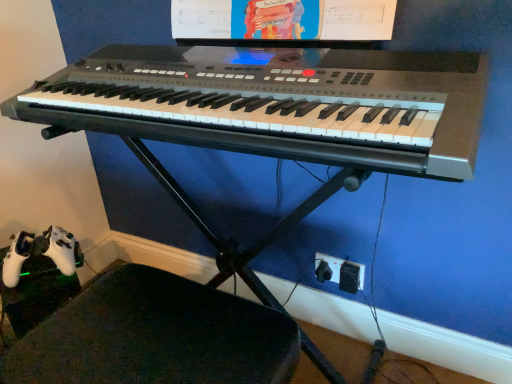
The height and width of the screenshot is (384, 512). In order to click on free space underneath matte plastic computer monitor at upper center (from a real-world perspective) in this screenshot , I will do `click(328, 49)`.